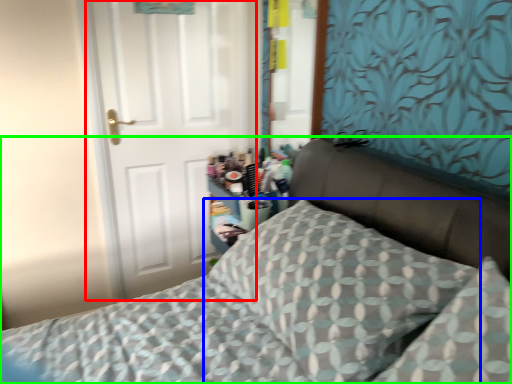
Question: Which object is positioned farthest from door (highlighted by a red box)? Select from pillow (highlighted by a blue box) and bed (highlighted by a green box).

Choices:
 (A) pillow
 (B) bed

Answer: (A)